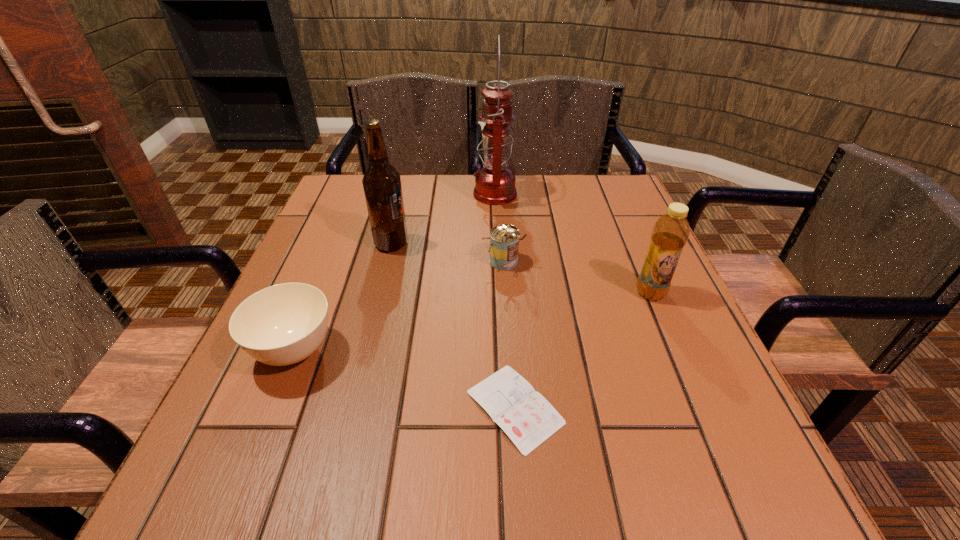
Locate an element on the screen. This screenshot has width=960, height=540. the farthest object is located at coordinates (495, 183).

Image resolution: width=960 pixels, height=540 pixels. I want to click on oil lamp, so click(x=495, y=183).

Image resolution: width=960 pixels, height=540 pixels. In order to click on beer bottle in this screenshot , I will do `click(382, 187)`.

The image size is (960, 540). In order to click on the second object from left to right in this screenshot , I will do `click(382, 187)`.

Where is `the rightmost object`? The image size is (960, 540). the rightmost object is located at coordinates (670, 233).

The height and width of the screenshot is (540, 960). What are the coordinates of `the third tallest object` in the screenshot? It's located at (670, 233).

Find the location of `the fourth tallest object`. the fourth tallest object is located at coordinates [504, 239].

Find the location of a particular element. This screenshot has height=540, width=960. the fifth tallest object is located at coordinates (283, 324).

Where is `sugar bowl`? Image resolution: width=960 pixels, height=540 pixels. sugar bowl is located at coordinates (283, 324).

You are a GUI agent. You are given a task and a screenshot of the screen. Output one action in this format:
    pyautogui.click(x=<x>, y=<y>)
    Task: Click on the diary
    
    Given the screenshot: What is the action you would take?
    pyautogui.click(x=526, y=417)